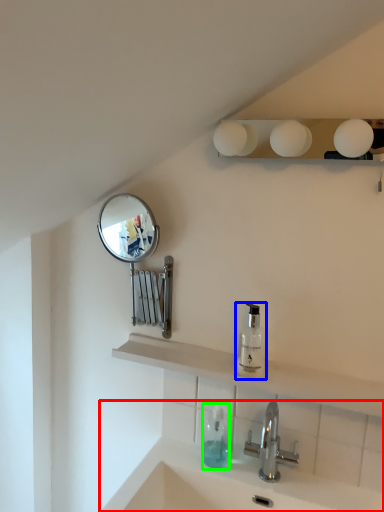
Question: Which object is the closest to the sink (highlighted by a red box)? Choose among these: soap dispenser (highlighted by a blue box) or soap dispenser (highlighted by a green box).

Choices:
 (A) soap dispenser
 (B) soap dispenser

Answer: (B)